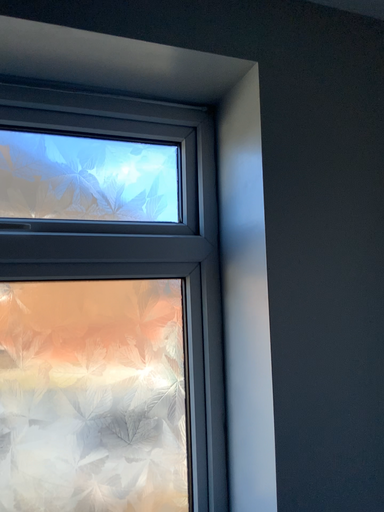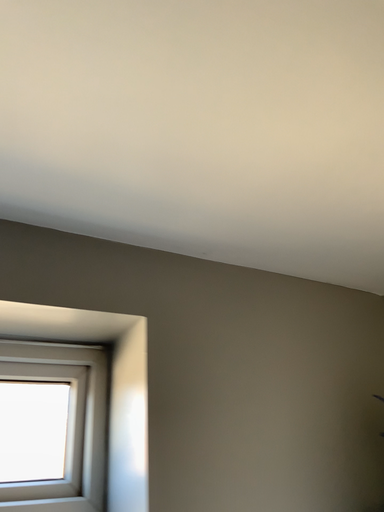
Question: How did the camera likely rotate when shooting the video?

Choices:
 (A) rotated downward
 (B) rotated upward

Answer: (B)